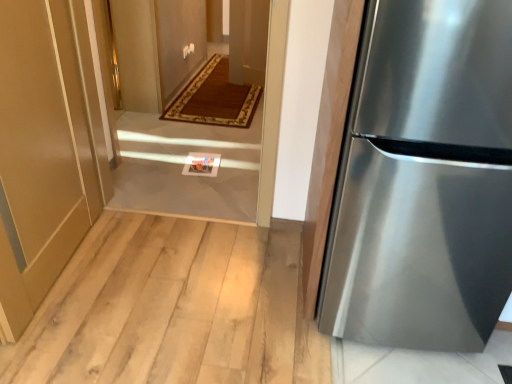
I want to click on vacant space in matte gold door at lower left (from a real-world perspective), so click(61, 267).